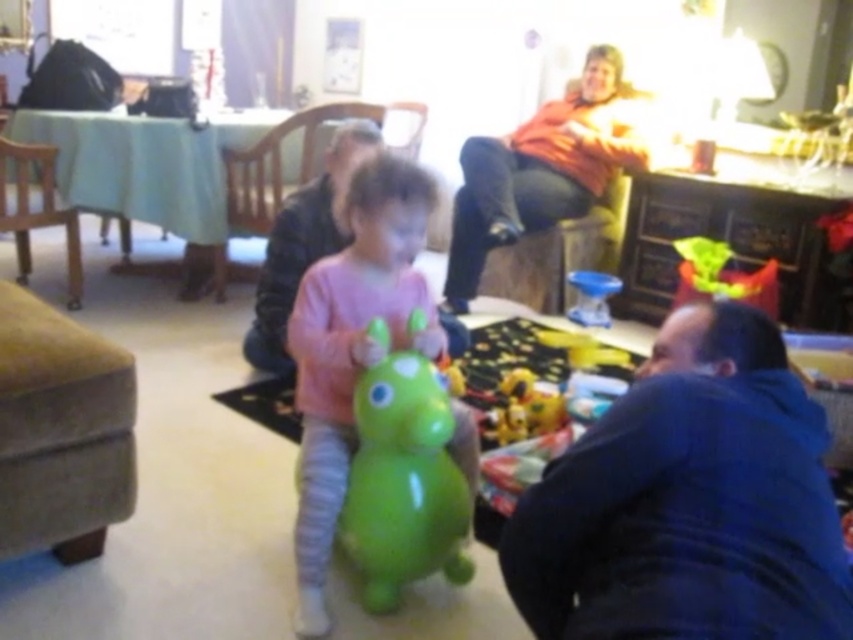
You are standing in the living room and want to reach a point that is exactly 3 meters away from you. Can you walk straight to the point labeled as point (57, 212)?

Yes, because the point labeled as point (57, 212) is exactly 3.02 meters away from the viewer, which is very close to 3 meters, so you can walk straight to it.

You are a guest entering the living room and want to sit down. There is a green rubber toy at center and a matte wood armchair at center. Which object should you interact with to find a place to sit?

You should interact with the matte wood armchair at center because it is a seating option, while the green rubber toy at center is an object meant for play and not for sitting.